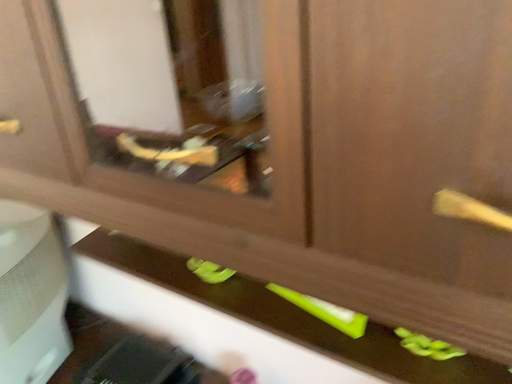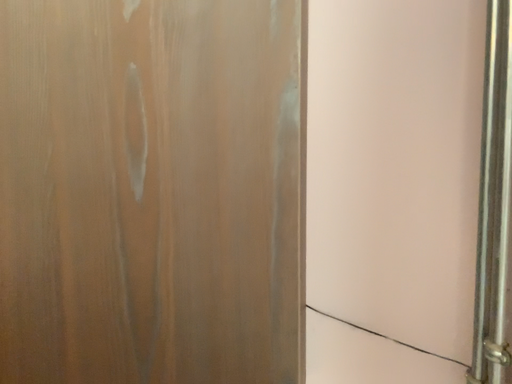
Question: Which way did the camera rotate in the video?

Choices:
 (A) rotated right
 (B) rotated left

Answer: (A)